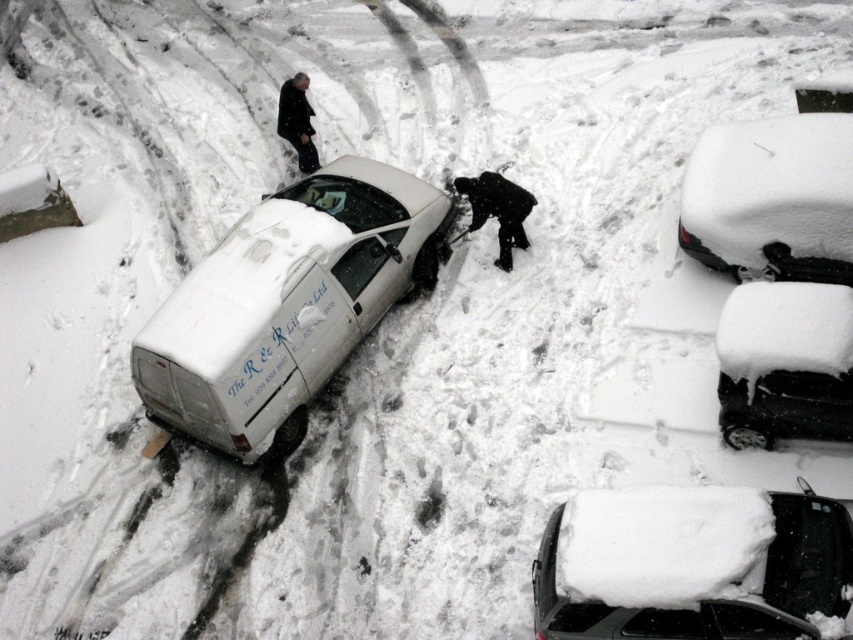
Question: Which is nearer to the black matte jacket at center right?

Choices:
 (A) black glossy car at lower right
 (B) white matte car at upper right
 (C) snow-covered car at lower right

Answer: (B)

Question: Which point is closer to the camera?

Choices:
 (A) white matte car at upper right
 (B) snow-covered car at lower right
 (C) black glossy car at lower right
 (D) white matte van at center

Answer: (B)

Question: Is white matte car at upper right closer to the viewer compared to black glossy car at lower right?

Choices:
 (A) no
 (B) yes

Answer: (A)

Question: Which point is closer to the camera?

Choices:
 (A) (830, 237)
 (B) (514, 220)
 (C) (738, 426)

Answer: (C)

Question: Can you confirm if white matte van at center is positioned to the left of black glossy car at lower right?

Choices:
 (A) no
 (B) yes

Answer: (B)

Question: Can you confirm if snow-covered car at lower right is positioned to the right of white matte car at upper right?

Choices:
 (A) no
 (B) yes

Answer: (A)